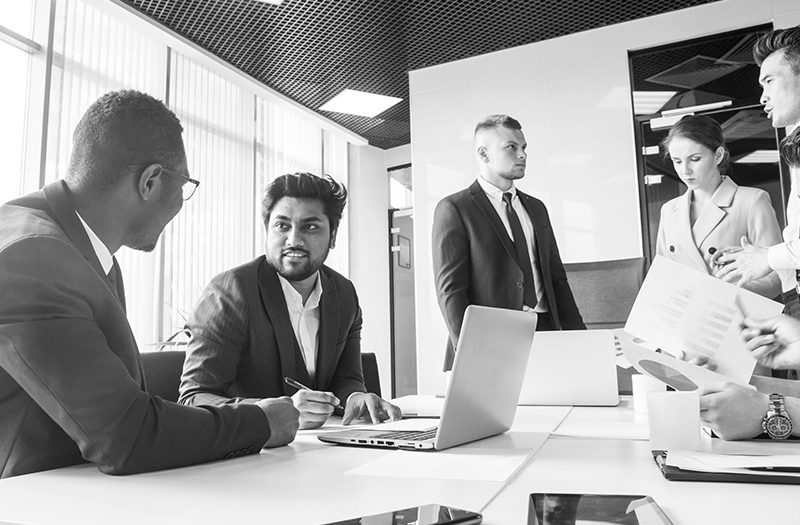
Where is `laptop`? laptop is located at coordinates point(481,395).